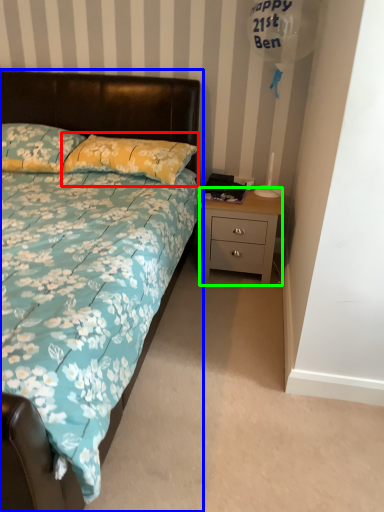
Question: Which object is positioned farthest from pillow (highlighted by a red box)? Select from bed (highlighted by a blue box) and nightstand (highlighted by a green box).

Choices:
 (A) bed
 (B) nightstand

Answer: (B)